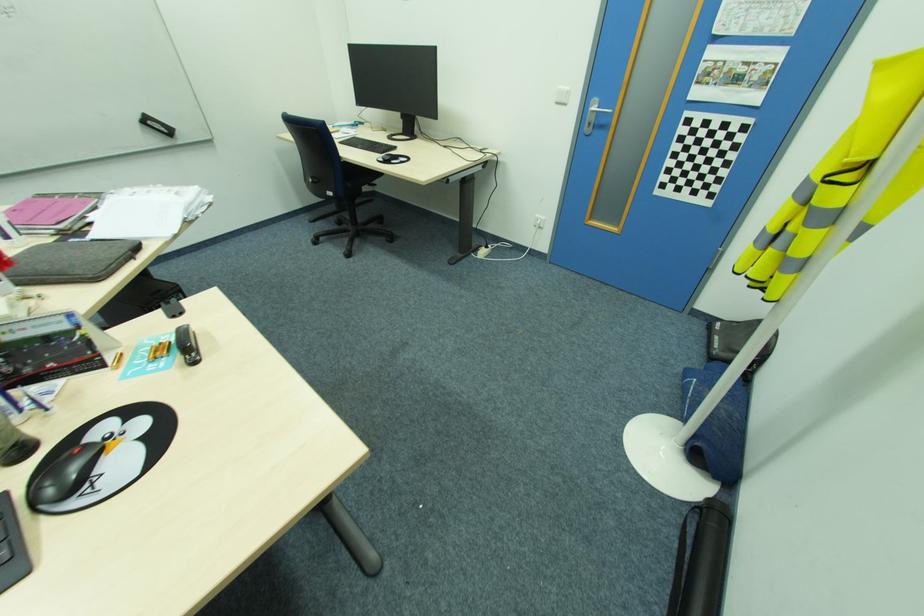
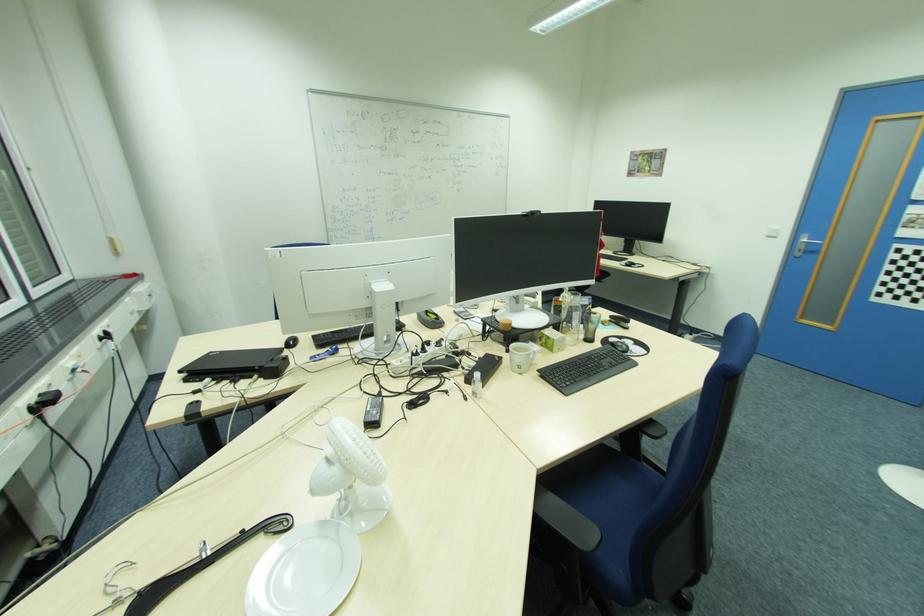
Where in the second image is the point corresponding to (x=592, y=124) from the first image?

(804, 251)